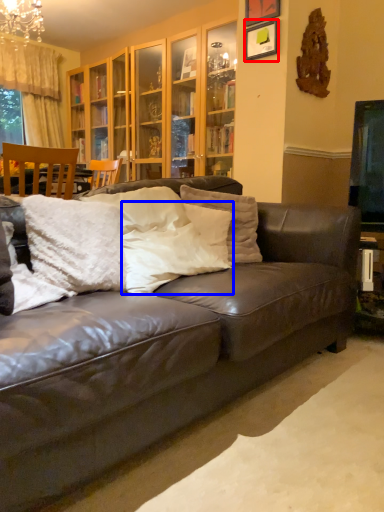
Question: Which object appears closest to the camera in this image, picture frame (highlighted by a red box) or pillow (highlighted by a blue box)?

Choices:
 (A) picture frame
 (B) pillow

Answer: (B)